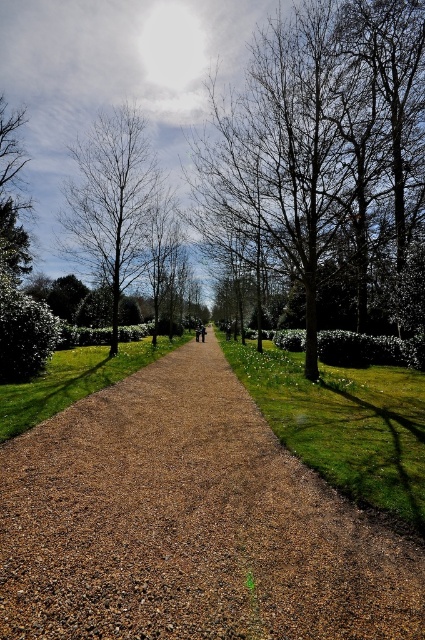
Question: Which object is positioned farthest from the brown leafless tree at center?

Choices:
 (A) brown gravel path at center
 (B) brown leafless tree at upper left

Answer: (B)

Question: Which object is closer to the camera taking this photo?

Choices:
 (A) brown leafless tree at upper left
 (B) brown gravel path at center

Answer: (B)

Question: Does brown gravel path at center appear on the right side of brown leafless tree at upper left?

Choices:
 (A) yes
 (B) no

Answer: (A)

Question: Which of these objects is positioned farthest from the brown leafless tree at upper left?

Choices:
 (A) brown leafless tree at center
 (B) brown gravel path at center

Answer: (B)

Question: Can you confirm if brown leafless tree at center is positioned below brown leafless tree at upper left?

Choices:
 (A) yes
 (B) no

Answer: (B)

Question: Does brown gravel path at center have a smaller size compared to brown leafless tree at upper left?

Choices:
 (A) no
 (B) yes

Answer: (A)